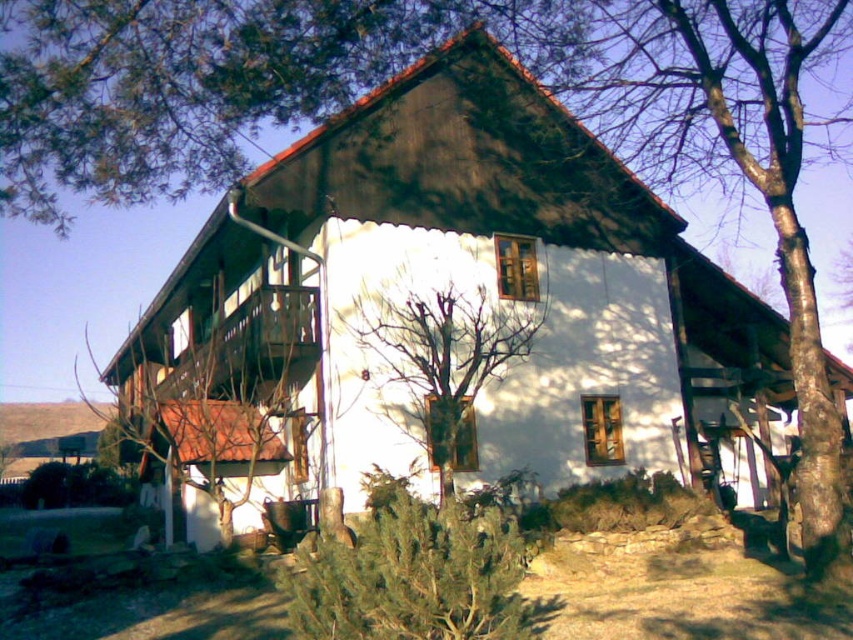
Question: Does green textured bush at lower center have a larger size compared to bare branches at center?

Choices:
 (A) yes
 (B) no

Answer: (B)

Question: Is white matte house at center bigger than green textured bush at lower center?

Choices:
 (A) yes
 (B) no

Answer: (A)

Question: Which of the following is the farthest from the observer?

Choices:
 (A) green textured bush at lower center
 (B) bare branches at center
 (C) white matte house at center

Answer: (B)

Question: Estimate the real-world distances between objects in this image. Which object is closer to the bare branches at center?

Choices:
 (A) white matte house at center
 (B) green textured bush at lower center

Answer: (A)

Question: Which object is farther from the camera taking this photo?

Choices:
 (A) white matte house at center
 (B) bare branches at center

Answer: (B)

Question: Is white matte house at center thinner than bare branches at center?

Choices:
 (A) no
 (B) yes

Answer: (A)